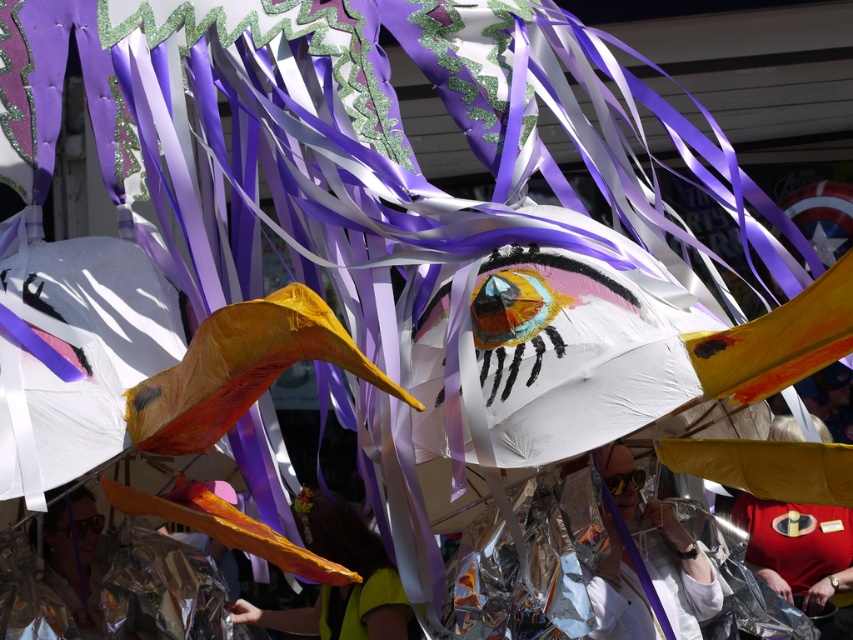
Between shiny metallic mask at center and red fabric shirt at lower right, which one is positioned lower?

shiny metallic mask at center is below.

Can you confirm if shiny metallic mask at center is smaller than red fabric shirt at lower right?

Yes.

Does point (641, 508) come in front of point (784, 532)?

Yes, point (641, 508) is in front of point (784, 532).

This screenshot has width=853, height=640. Identify the location of shiny metallic mask at center. (663, 547).

Between point (820, 582) and point (270, 618), which one is positioned behind?

The point (820, 582) is behind.

Which of these two, red fabric shirt at lower right or yellow fabric at center, stands taller?

red fabric shirt at lower right is taller.

Image resolution: width=853 pixels, height=640 pixels. Describe the element at coordinates (801, 554) in the screenshot. I see `red fabric shirt at lower right` at that location.

Identify the location of red fabric shirt at lower right. The height and width of the screenshot is (640, 853). (801, 554).

Where is `shiny metallic mask at center`? shiny metallic mask at center is located at coordinates [663, 547].

Locate an element on the screen. The image size is (853, 640). shiny metallic mask at center is located at coordinates (663, 547).

Find the location of a particular element. shiny metallic mask at center is located at coordinates (663, 547).